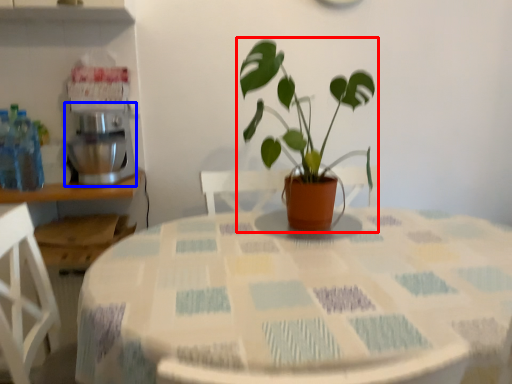
Question: Among these objects, which one is farthest to the camera, houseplant (highlighted by a red box) or mixer (highlighted by a blue box)?

Choices:
 (A) houseplant
 (B) mixer

Answer: (B)